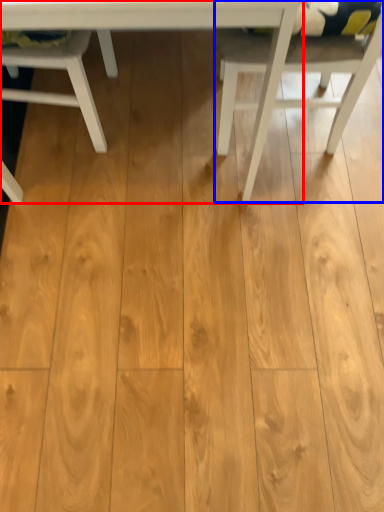
Question: Among these objects, which one is farthest to the camera, table (highlighted by a red box) or chair (highlighted by a blue box)?

Choices:
 (A) table
 (B) chair

Answer: (B)